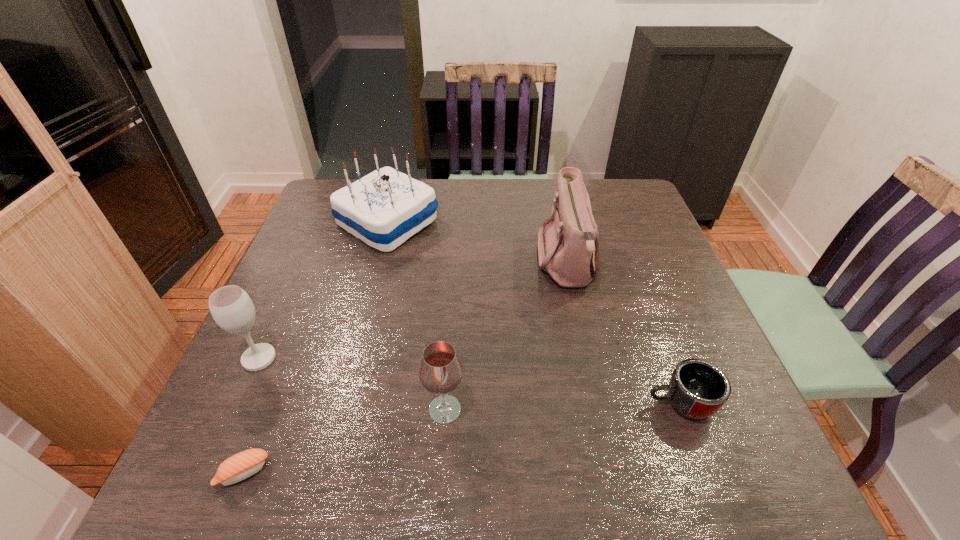
Locate an element on the screen. Image resolution: width=960 pixels, height=540 pixels. birthday cake is located at coordinates (386, 207).

Locate an element on the screen. the second object from right to left is located at coordinates (569, 252).

The image size is (960, 540). I want to click on the third farthest object, so click(x=231, y=307).

Where is `the left wineglass`? The width and height of the screenshot is (960, 540). the left wineglass is located at coordinates (231, 307).

The image size is (960, 540). Identify the location of the right wineglass. (440, 372).

I want to click on the third object from right to left, so click(440, 372).

Find the location of a particular element. Image resolution: width=960 pixels, height=540 pixels. the fifth tallest object is located at coordinates pos(698,389).

I want to click on mug, so pyautogui.click(x=698, y=389).

Identify the location of sushi. (240, 466).

The image size is (960, 540). I want to click on the shortest object, so click(240, 466).